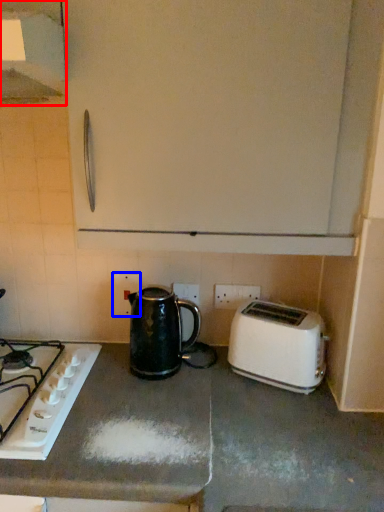
Question: Among these objects, which one is farthest to the camera, exhaust hood (highlighted by a red box) or electric outlet (highlighted by a blue box)?

Choices:
 (A) exhaust hood
 (B) electric outlet

Answer: (B)